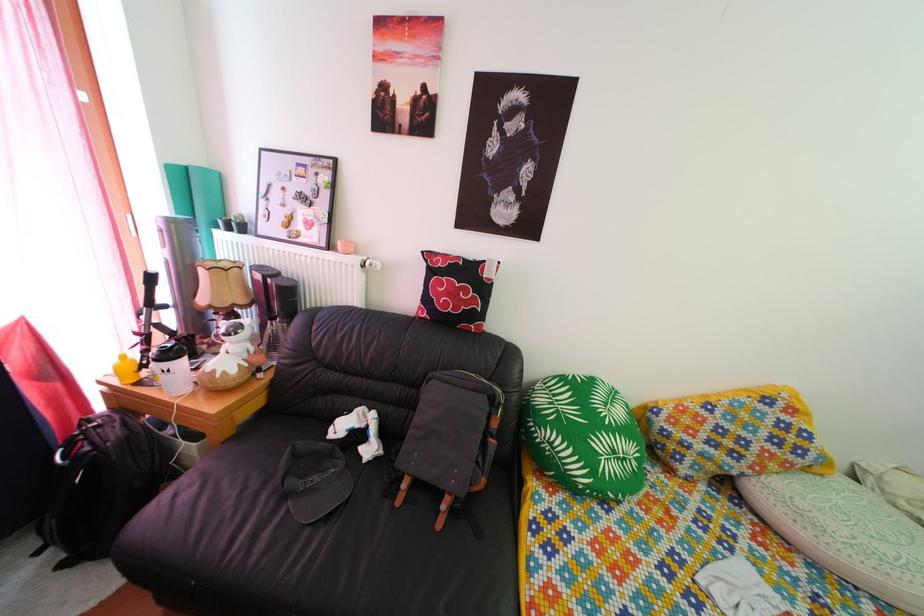
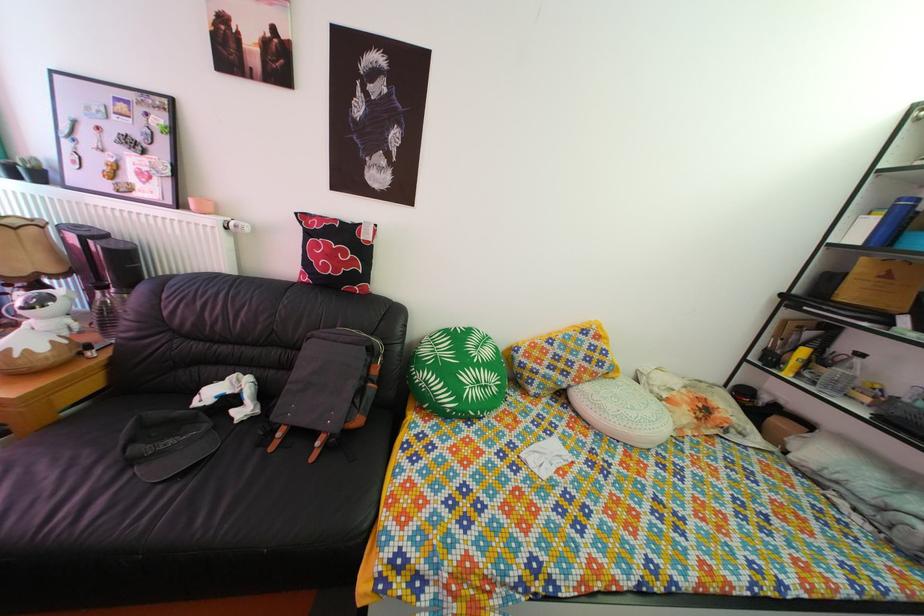
Locate, in the second image, the point that corresponds to point 634,468 in the first image.

(494, 395)